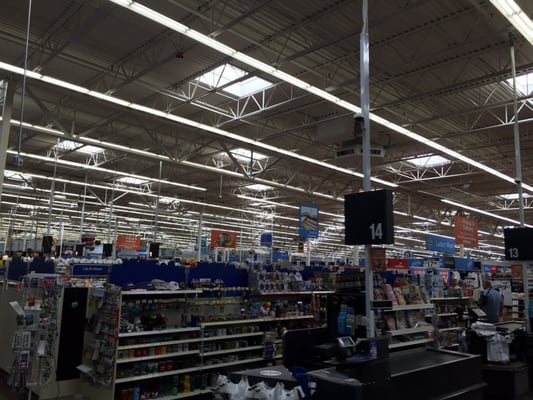
Find the location of a particular element. books or magazined is located at coordinates (397, 299), (402, 320), (416, 320), (416, 299), (390, 323).